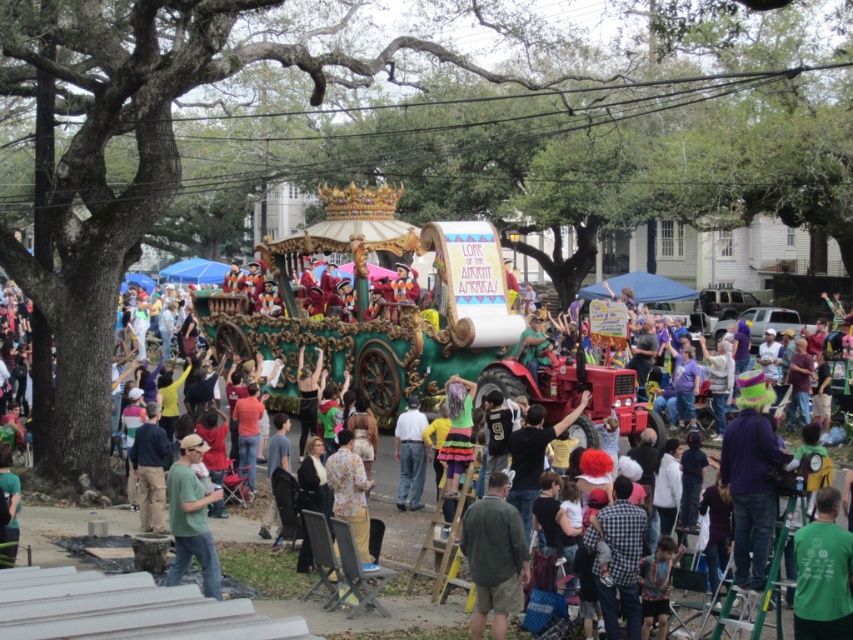
You are a photographer at the parade trying to capture both the green cotton shirt at center and the neon green jersey at center in a single shot. Which clothing item should you focus on first to ensure both are in frame?

The green cotton shirt at center is positioned under the neon green jersey at center, so focusing on the neon green jersey at center first will allow the photographer to include both items in the frame since the shirt is below it.

You are standing at the center of the parade route and see the point marked at coordinates point [822,573]. Based on the scene, what is the most likely object or person located at that coordinate?

The point [822,573] corresponds to the green fabric shirt at lower right.